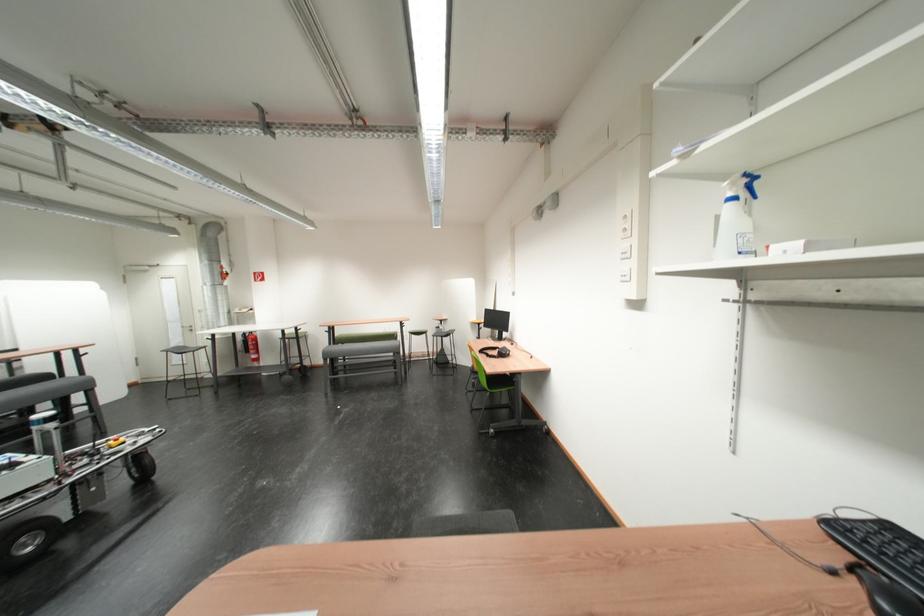
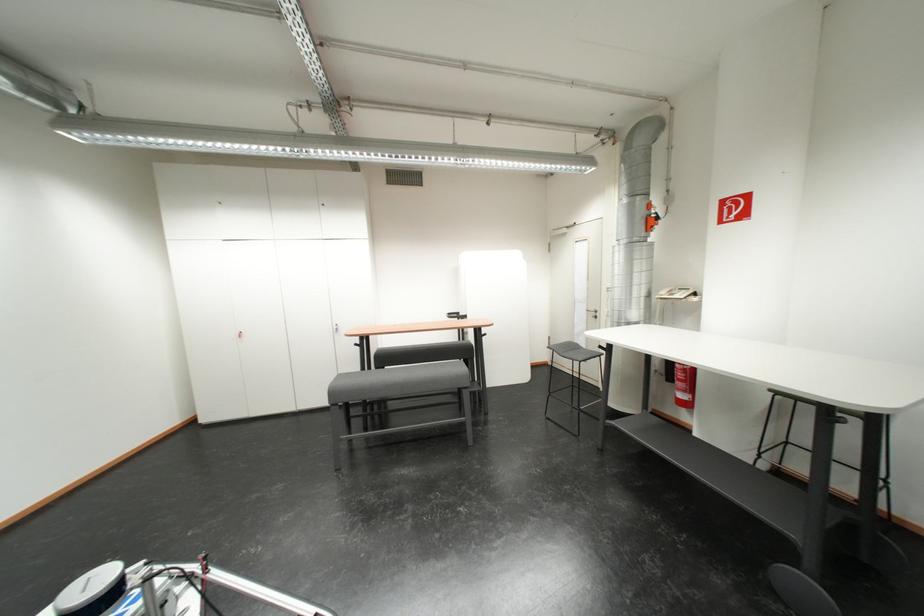
Locate, in the second image, the point that corresponds to the point at 248,313 in the first image.

(675, 296)